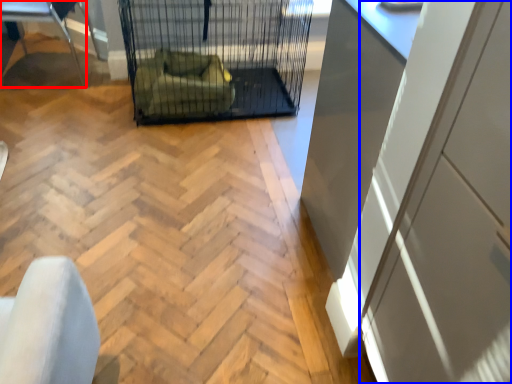
Question: Among these objects, which one is nearest to the camera, furniture (highlighted by a red box) or screen door (highlighted by a blue box)?

Choices:
 (A) furniture
 (B) screen door

Answer: (B)